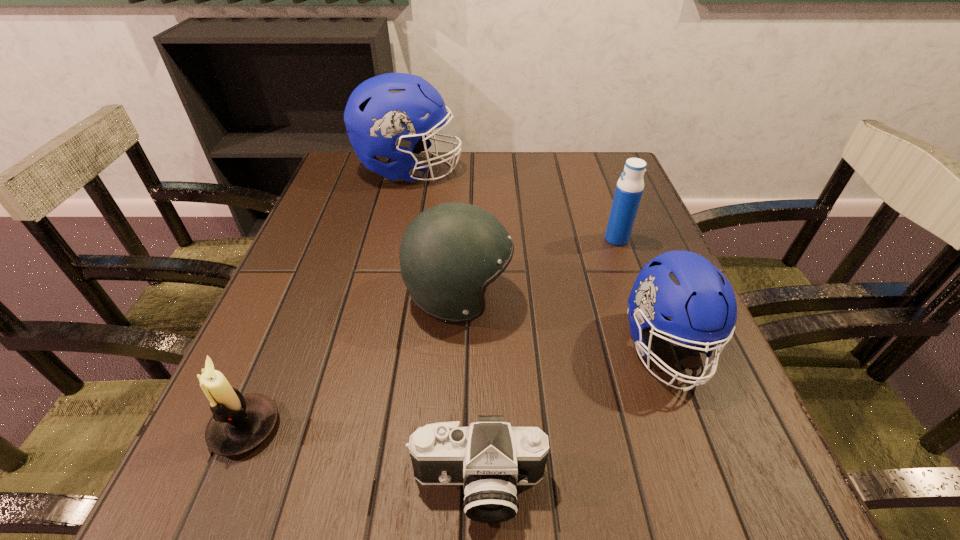
The image size is (960, 540). In order to click on the tallest object in this screenshot , I will do `click(382, 116)`.

Find the location of a particular element. The width and height of the screenshot is (960, 540). the farthest object is located at coordinates (382, 116).

The width and height of the screenshot is (960, 540). In order to click on water bottle in this screenshot , I will do `click(629, 188)`.

Identify the location of the rightmost football helmet. This screenshot has height=540, width=960. (682, 285).

The height and width of the screenshot is (540, 960). What are the coordinates of `candle holder` in the screenshot? It's located at (240, 423).

Locate an element on the screen. the shortest object is located at coordinates (490, 458).

Locate an element on the screen. free space located 0.140m on the front-facing side of the tallest object is located at coordinates (514, 170).

Locate an element on the screen. This screenshot has width=960, height=540. vacant space situated on the back of the fifth nearest object is located at coordinates (593, 175).

Where is `free space located on the face guard of the rightmost football helmet`? The height and width of the screenshot is (540, 960). free space located on the face guard of the rightmost football helmet is located at coordinates (730, 511).

At what (x,y) coordinates should I click in order to perform the action: click on free spot located on the right of the candle holder. Please return your answer as a coordinate pair (x, y). Looking at the image, I should click on [x=435, y=428].